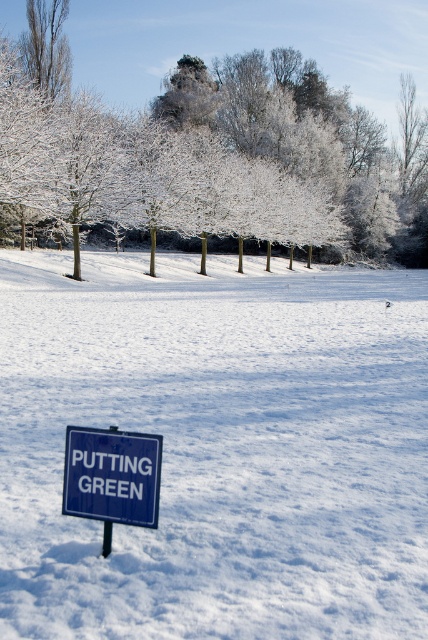
Question: Can you confirm if white powdery snow at center is positioned above blue plastic sign at lower left?

Choices:
 (A) yes
 (B) no

Answer: (A)

Question: Estimate the real-world distances between objects in this image. Which object is closer to the white powdery snow at center?

Choices:
 (A) blue plastic sign at lower left
 (B) metallic pole at lower center
 (C) white frosty tree at center

Answer: (A)

Question: Is white powdery snow at center bigger than metallic pole at lower center?

Choices:
 (A) yes
 (B) no

Answer: (A)

Question: Which point appears farthest from the camera in this image?

Choices:
 (A) (259, 56)
 (B) (6, 550)
 (C) (109, 541)
 (D) (107, 515)

Answer: (A)

Question: Which object appears closest to the camera in this image?

Choices:
 (A) white frosty tree at center
 (B) blue plastic sign at lower left

Answer: (B)

Question: Can you confirm if white frosty tree at center is smaller than metallic pole at lower center?

Choices:
 (A) yes
 (B) no

Answer: (B)